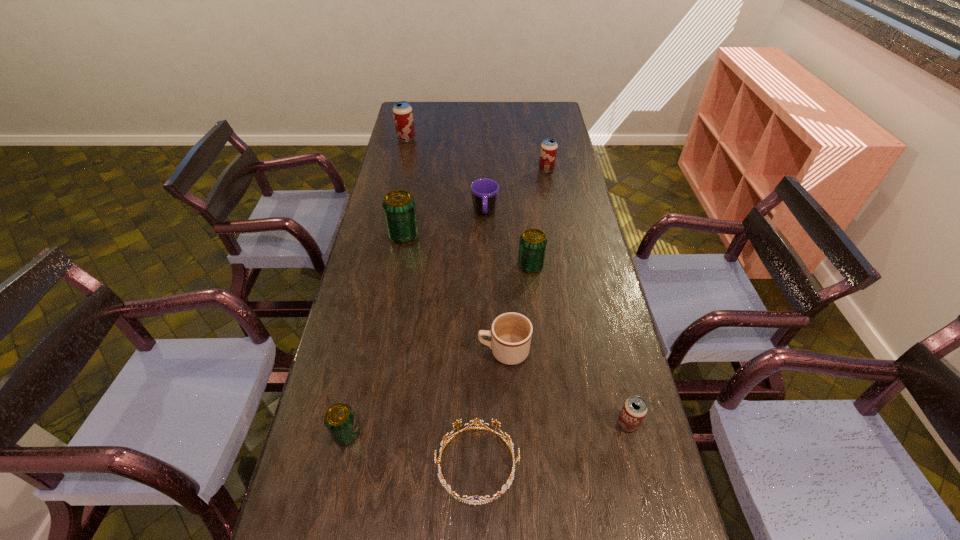
The width and height of the screenshot is (960, 540). Find the location of `vacant space located 0.380m on the side of the nearer mug with the handle`. vacant space located 0.380m on the side of the nearer mug with the handle is located at coordinates (344, 352).

Image resolution: width=960 pixels, height=540 pixels. Identify the location of free space located 0.290m on the side of the nearer mug with the handle. (375, 352).

Where is `free spot located 0.050m on the side of the nearer mug with the handle`? This screenshot has width=960, height=540. free spot located 0.050m on the side of the nearer mug with the handle is located at coordinates (461, 352).

The height and width of the screenshot is (540, 960). I want to click on vacant space located with the handle on the side of the black mug, so click(485, 256).

The height and width of the screenshot is (540, 960). In order to click on free space located on the front of the smallest green beer can in this screenshot , I will do `click(336, 482)`.

Image resolution: width=960 pixels, height=540 pixels. I want to click on free space located on the back of the rightmost object, so click(x=614, y=369).

This screenshot has height=540, width=960. In order to click on free region located on the front-facing side of the shortest object in this screenshot , I will do `click(553, 463)`.

The image size is (960, 540). In order to click on free spot at the far edge of the desktop in this screenshot , I will do `click(474, 111)`.

The height and width of the screenshot is (540, 960). What are the coordinates of `vacant area at the left edge` in the screenshot? It's located at (x=392, y=276).

I want to click on free space at the right edge of the desktop, so click(564, 242).